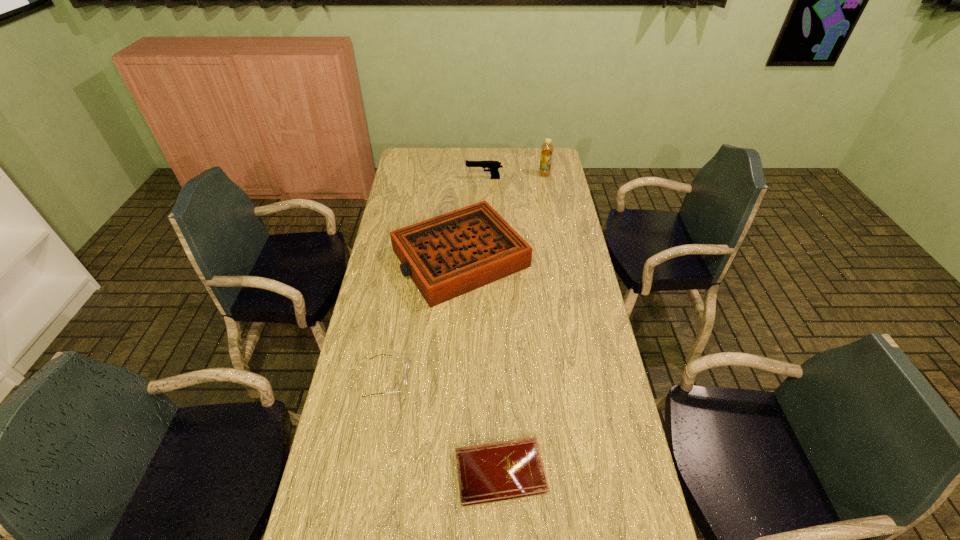
Where is `vacant point located 0.250m on the front-facing side of the pistol`? The image size is (960, 540). vacant point located 0.250m on the front-facing side of the pistol is located at coordinates pos(415,178).

This screenshot has height=540, width=960. What are the coordinates of `vacant region located 0.220m on the front-facing side of the pistol` in the screenshot? It's located at (420, 178).

This screenshot has height=540, width=960. I want to click on free region located on the front of the third farthest object, so click(x=456, y=361).

Where is `vacant region located through the lenses of the spectacles`? vacant region located through the lenses of the spectacles is located at coordinates (447, 378).

Where is `free space located 0.080m on the right of the shortest object`? free space located 0.080m on the right of the shortest object is located at coordinates click(x=577, y=471).

Where is `object that is at the far edge`? object that is at the far edge is located at coordinates (547, 148).

This screenshot has height=540, width=960. Identify the location of gameboard present at the left edge. (449, 255).

At what (x,y) coordinates should I click in order to perform the action: click on spectacles present at the left edge. Please return your answer as a coordinate pair (x, y). Looking at the image, I should click on (407, 364).

The height and width of the screenshot is (540, 960). I want to click on object that is at the right edge, so click(x=547, y=148).

The image size is (960, 540). I want to click on object situated at the far right corner, so click(x=547, y=148).